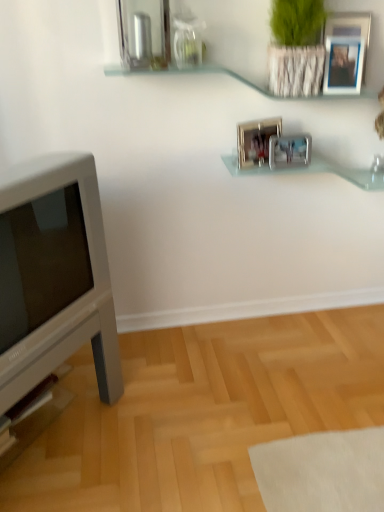
Question: In terms of size, does clear glass shelf at upper center, which is counted as the 2th shelf, starting from the bottom, appear bigger or smaller than metallic silver picture frame at upper center, marked as the 1th picture frame in a right-to-left arrangement?

Choices:
 (A) big
 (B) small

Answer: (A)

Question: From a real-world perspective, is clear glass shelf at upper center, which is counted as the 2th shelf, starting from the bottom, above or below metallic silver picture frame at upper center, the third picture frame ordered from the bottom?

Choices:
 (A) below
 (B) above

Answer: (A)

Question: Based on their relative distances, which object is nearer to the white glossy television at left?

Choices:
 (A) metallic silver picture frame at center, the 2th picture frame viewed from the left
 (B) clear glass shelf at upper center, the 1th shelf in the top-to-bottom sequence
 (C) clear glass shelf at center, the 2th shelf when ordered from top to bottom
 (D) metallic silver picture frame at upper center, marked as the 1th picture frame in a right-to-left arrangement
 (E) metallic silver picture frame at center, acting as the 2th picture frame starting from the top

Answer: (B)

Question: Which is nearer to the white glossy television at left?

Choices:
 (A) clear glass shelf at upper center, which is counted as the 2th shelf, starting from the bottom
 (B) metallic silver picture frame at center, which is the first picture frame from bottom to top
 (C) green textured plant at upper right
 (D) metallic silver picture frame at upper center, acting as the first picture frame starting from the top
 (E) metallic silver picture frame at center, arranged as the 1th picture frame when viewed from the left

Answer: (A)